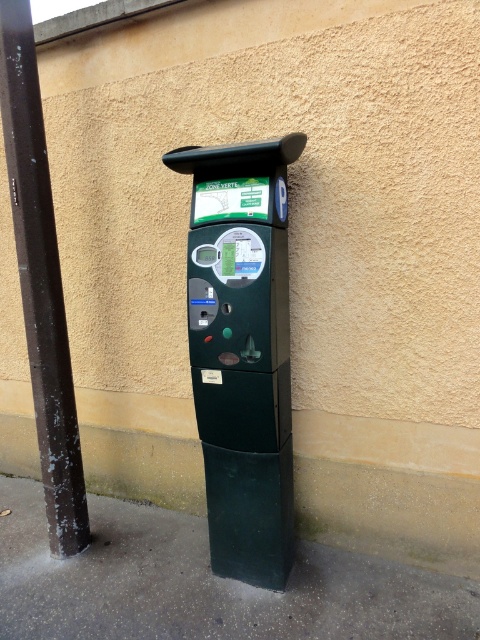
You are a delivery person trying to place a package in a spot near the parking ticket machine. You have two options between the green matte trash can at lower center and the dark brown metal pole at left. Which object is wider and better suited for placing a larger package?

The green matte trash can at lower center is wider than the dark brown metal pole at left, so it is better suited for placing a larger package.

You are standing in front of the parking ticket machine and want to place a small object exactly at the point indicated by the coordinates point (204, 584). Based on the scene description, where would this location be relative to the parking ticket machine?

The point (204, 584) corresponds to the dark gray concrete pavement at lower center, which is located below the parking ticket machine.

You are a visitor who just arrived at the parking lot and need to dispose of a recyclable item. You see the green matte trash can at lower center and the dark brown metal pole at left. Which object is positioned to the right of the other?

The green matte trash can at lower center is positioned to the right of the dark brown metal pole at left.